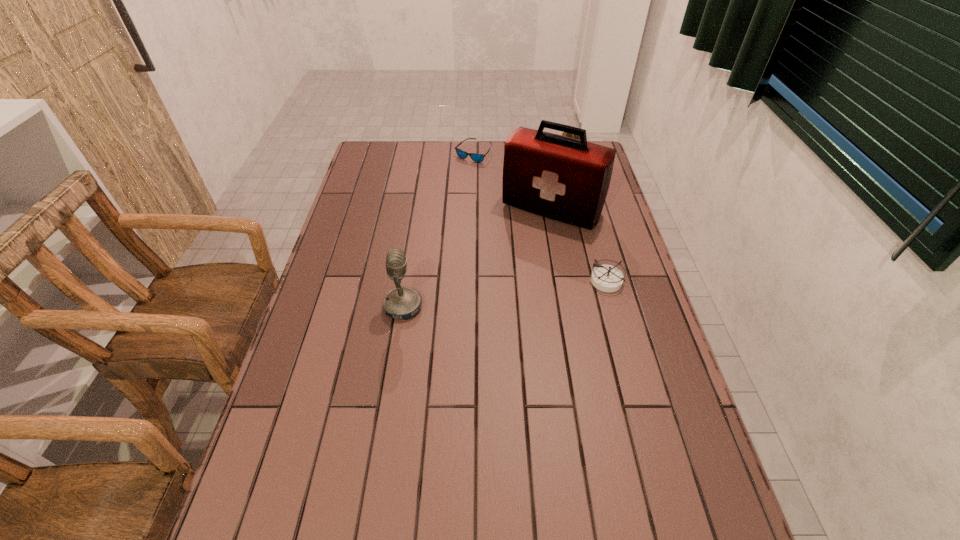
Locate an element on the screen. free spot located with the dial facing the third shortest object is located at coordinates (539, 205).

I want to click on sunglasses located in the far edge section of the desktop, so tap(475, 157).

Where is `compass present at the far edge`? compass present at the far edge is located at coordinates (564, 133).

Locate an element on the screen. The width and height of the screenshot is (960, 540). the first aid kit that is at the right edge is located at coordinates pos(562,178).

Identify the location of object present at the far right corner. (564, 133).

This screenshot has width=960, height=540. In the image, there is a desktop. Identify the location of vacant space at the far edge. (444, 151).

In the image, there is a desktop. Where is `vacant area at the near edge`? vacant area at the near edge is located at coordinates (623, 481).

The width and height of the screenshot is (960, 540). Find the location of `vacant space at the left edge of the desktop`. vacant space at the left edge of the desktop is located at coordinates (296, 420).

In the image, there is a desktop. Where is `vacant area at the right edge`? The height and width of the screenshot is (540, 960). vacant area at the right edge is located at coordinates (613, 209).

In the image, there is a desktop. At what (x,y) coordinates should I click in order to perform the action: click on vacant space at the far right corner. Please return your answer as a coordinate pair (x, y). Looking at the image, I should click on (589, 142).